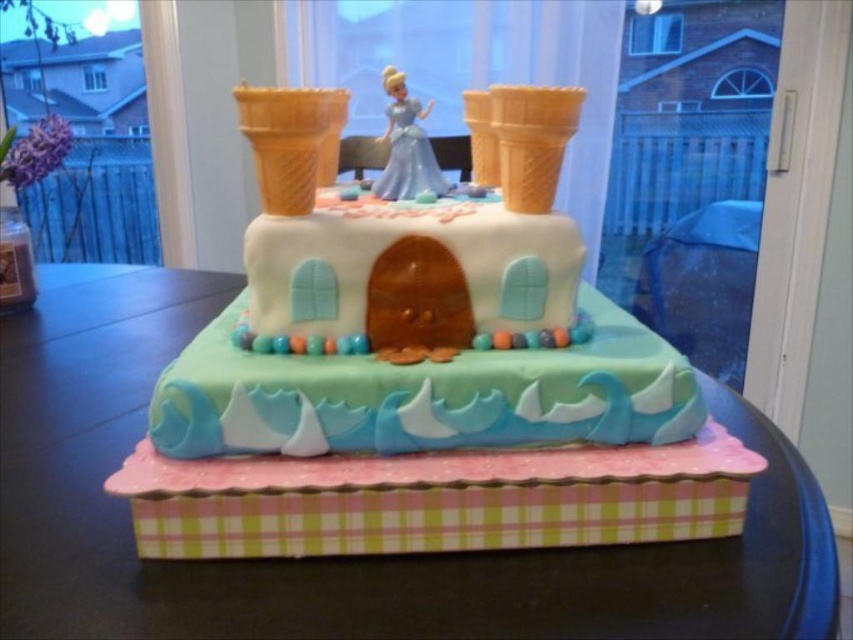
Consider the image. You are a cake decorator who needs to place a ribbon between the golden waffle cone at upper center and the golden waffle cone at upper right. The ribbon is 10 centimeters long. Will the ribbon be long enough to stretch between them?

The golden waffle cone at upper center and golden waffle cone at upper right are 11.31 centimeters apart. Since the ribbon is only 10 centimeters long, it will not be long enough to stretch between them.

You are a guest at a birthday party and want to place a 12 inch long candle between the golden waffle cone at upper right and another object. Is there enough space?

The golden waffle cone at upper right and the other object are 14.76 inches apart, so yes, the 12 inch candle can fit between them.

You are a guest at a birthday party and want to place a small candle on the tallest object in the image. Which object should you choose between the pink paperboard at center and the golden waffle cone at upper center?

The pink paperboard at center is taller than the golden waffle cone at upper center, so you should place the candle on the pink paperboard at center.